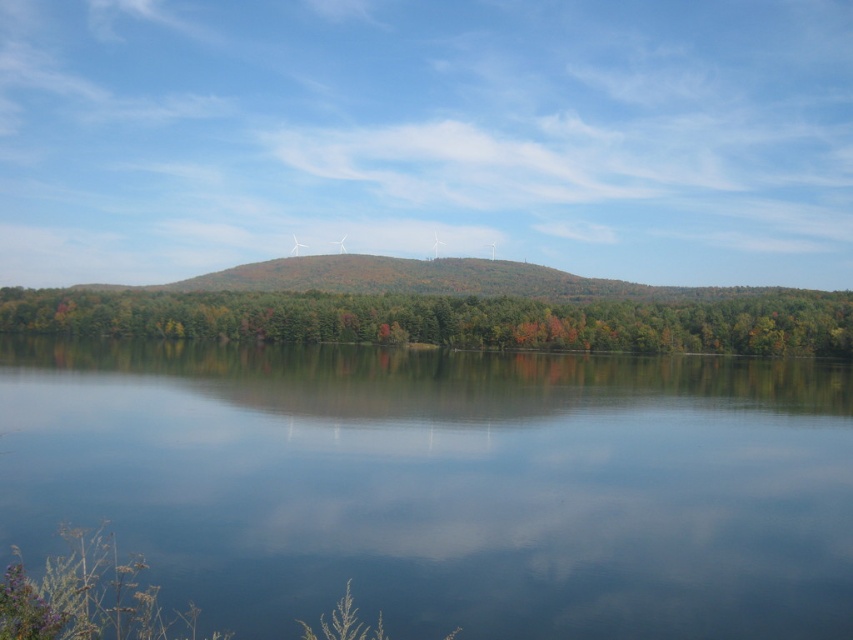
You are standing at the edge of the lake and see the transparent water at center and the green matte tree at center. Which object is shorter in height?

The transparent water at center has a lesser height compared to the green matte tree at center, so the transparent water at center is shorter in height.

You are standing at the edge of the lake and want to take a photo of the transparent water at center. Where should you position yourself to capture the reflection of the sky in the water?

You should position yourself at point [444,484] to capture the reflection of the sky in the transparent water at center.

You are standing at the edge of the scene and want to cross to the other side. The transparent water at center and the green matte tree at center are in your path. Which one do you need to go around because it is wider?

The green matte tree at center is wider than the transparent water at center, so you need to go around the green matte tree at center.